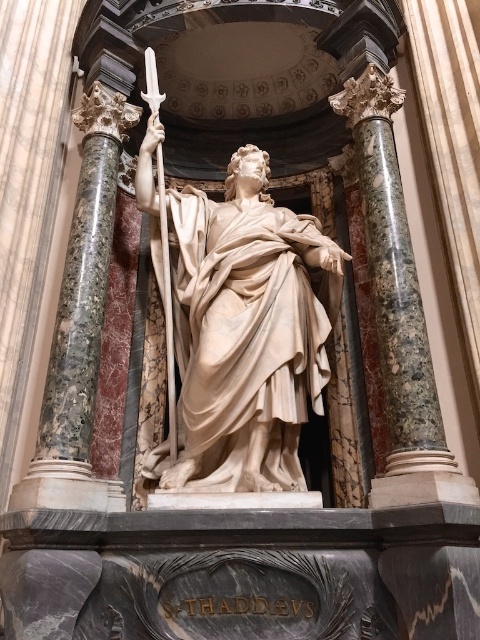
You are an art conservator assessing the placement of the matte white statue at center and the green marble column at right in the niche. Based on their heights, which object would require a taller base to ensure both are at eye level for visitors?

The matte white statue at center is shorter than the green marble column at right, so the statue would need a taller base to reach eye level with the column.

You are an architect inspecting the statue of Saint Thaddeus. You notice a green marble column at right located at point (397, 308). What is the color of the column at this coordinate?

The green marble column at right located at point (397, 308) is green in color.